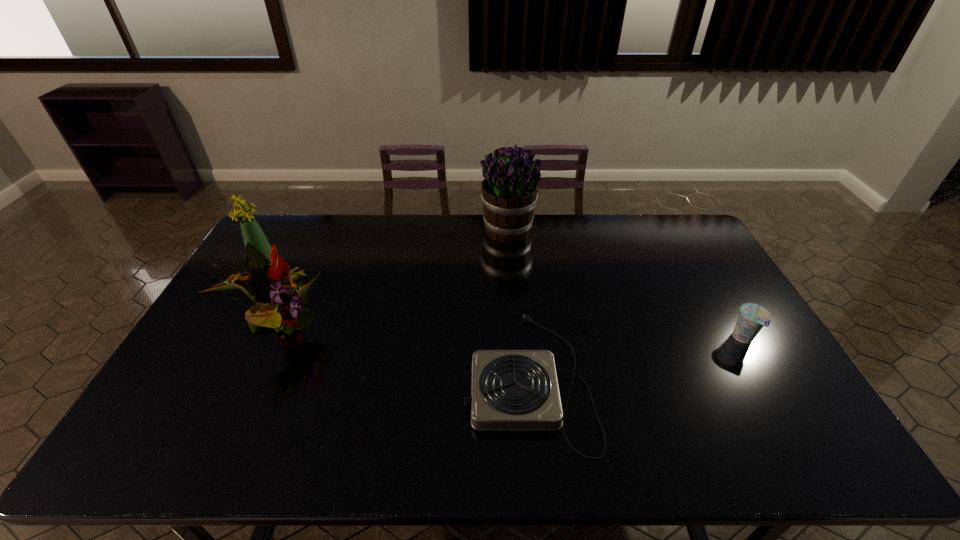
Identify the location of blank region between the rightmost object and the second bouquet from left to right. (514, 337).

Identify which object is the second nearest to the hotplate. Please provide its 2D coordinates. Your answer should be formatted as a tuple, i.e. [(x, y)], where the tuple contains the x and y coordinates of a point satisfying the conditions above.

[(275, 311)]

Select which object appears as the third closest to the farthest object. Please provide its 2D coordinates. Your answer should be formatted as a tuple, i.e. [(x, y)], where the tuple contains the x and y coordinates of a point satisfying the conditions above.

[(752, 317)]

Where is `bouquet object that ranks as the second closest to the leftmost bouquet`? The width and height of the screenshot is (960, 540). bouquet object that ranks as the second closest to the leftmost bouquet is located at coordinates (509, 193).

Identify which bouquet is the third closest to the hotplate. Please provide its 2D coordinates. Your answer should be formatted as a tuple, i.e. [(x, y)], where the tuple contains the x and y coordinates of a point satisfying the conditions above.

[(251, 231)]

This screenshot has width=960, height=540. What are the coordinates of `free space that satisfies the following two spatial constraints: 1. on the front-facing side of the fourth object from right to left; 2. on the back side of the yogurt` in the screenshot? It's located at (282, 339).

Locate an element on the screen. free space that satisfies the following two spatial constraints: 1. on the front-facing side of the leftmost bouquet; 2. on the back side of the yogurt is located at coordinates (227, 339).

Find the location of a particular element. Image resolution: width=960 pixels, height=540 pixels. free spot that satisfies the following two spatial constraints: 1. on the front-facing side of the second bouquet from right to left; 2. on the back side of the second shortest object is located at coordinates (282, 339).